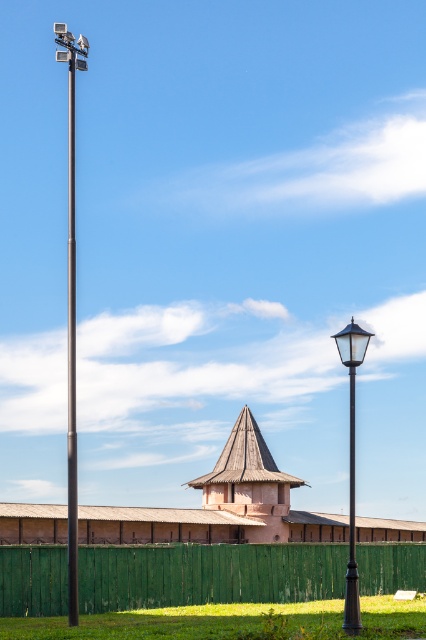
You are a gardener who needs to place a new 100 feet long decorative fence between the green wooden fence at lower center and the polished metal pole at center. Can you fit the new fence between them?

The distance between the green wooden fence at lower center and the polished metal pole at center is 90.16 feet. Since the new fence is 100 feet long, it cannot be placed between them as it is longer than the available space.

You are a gardener trying to install a new fence post that needs to be taller than the existing green wooden fence at lower center but shorter than the metallic pole at left. Is this possible?

Yes, it is possible to install a new fence post taller than the green wooden fence at lower center but shorter than the metallic pole at left since the metallic pole at left is taller than the green wooden fence at lower center.

You are a city planner assessing the placement of streetlights. You have two options for a new installation. The first is the polished metal pole at center, and the second is the black metal street light at right. Considering their widths, which option would you choose if you need a wider base for better stability in windy conditions?

The polished metal pole at center has a greater width than the black metal street light at right, making it a better choice for stability in windy conditions due to its wider base.